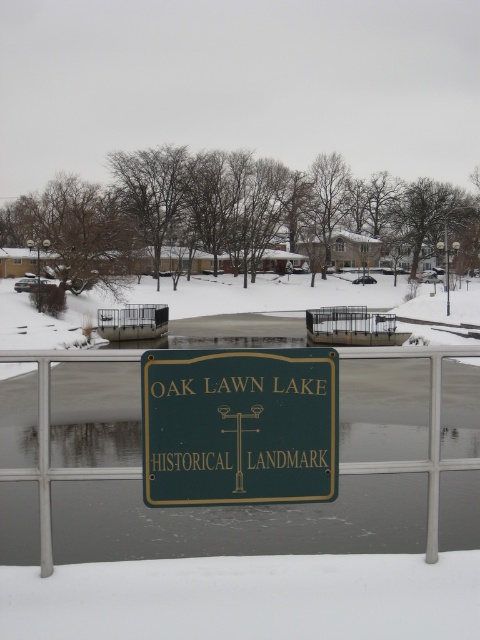
You are standing at the metal railing in front of the green sign. You notice two points marked on the image. Which point, point 1 at coordinates (335, 362) or point 2 at (432, 467), is closer to you?

Point 1 at coordinates (335, 362) is closer to you than point 2 at (432, 467).

What is located at the point with coordinates (239, 426) in the image?

The point at coordinates (239, 426) marks the location of the green polished wood sign at center.